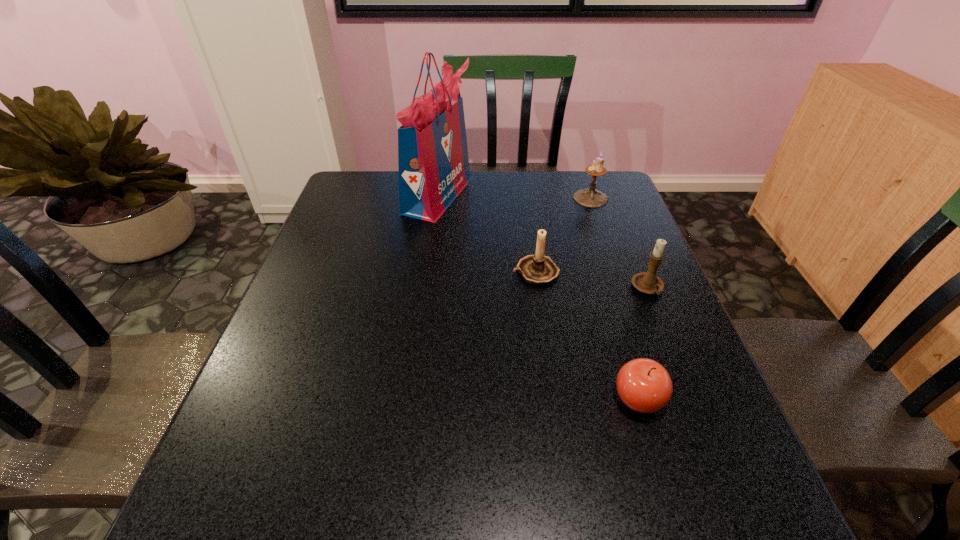
The image size is (960, 540). Identify the location of the leftmost object. (433, 163).

You are a GUI agent. You are given a task and a screenshot of the screen. Output one action in this format:
    pyautogui.click(x=<x>, y=<y>)
    Task: Click on the tallest object
    
    Given the screenshot: What is the action you would take?
    pyautogui.click(x=433, y=163)

Where is `the farthest candle holder`? the farthest candle holder is located at coordinates (589, 197).

The height and width of the screenshot is (540, 960). Identify the location of the fourth object from right to left. (537, 269).

Find the location of a particular element. The height and width of the screenshot is (540, 960). the shortest object is located at coordinates (644, 385).

Find the location of a particular element. This screenshot has width=960, height=540. the nearest object is located at coordinates (644, 385).

Where is `free location located on the front-facing side of the tallest object`? The image size is (960, 540). free location located on the front-facing side of the tallest object is located at coordinates (525, 195).

This screenshot has height=540, width=960. What are the coordinates of `vacant space located 0.110m on the left of the farthest candle holder` in the screenshot? It's located at (539, 198).

Where is `vacant area situated 0.340m on the front of the fourth object from right to left`? Image resolution: width=960 pixels, height=540 pixels. vacant area situated 0.340m on the front of the fourth object from right to left is located at coordinates (555, 408).

Identify the location of vacant space located 0.390m on the back of the shortest object. The height and width of the screenshot is (540, 960). (594, 256).